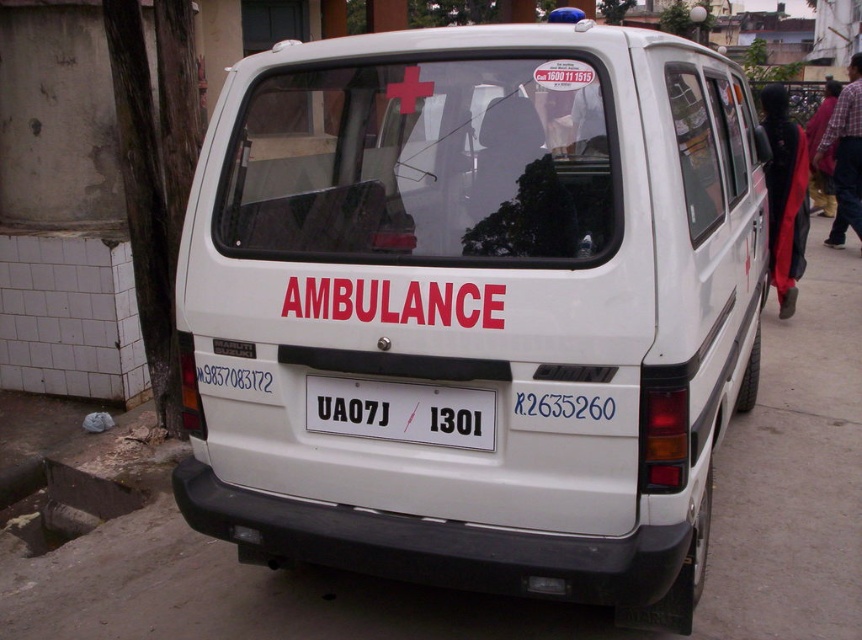
Question: Which point is closer to the camera?

Choices:
 (A) (358, 417)
 (B) (428, 557)

Answer: (B)

Question: Can you confirm if white matte van at center is thinner than white plastic license plate at center?

Choices:
 (A) no
 (B) yes

Answer: (A)

Question: Observing the image, what is the correct spatial positioning of white matte van at center in reference to white plastic license plate at center?

Choices:
 (A) below
 (B) above

Answer: (B)

Question: Which object appears closest to the camera in this image?

Choices:
 (A) white plastic license plate at center
 (B) white matte van at center

Answer: (B)

Question: Is white matte van at center behind white plastic license plate at center?

Choices:
 (A) yes
 (B) no

Answer: (B)